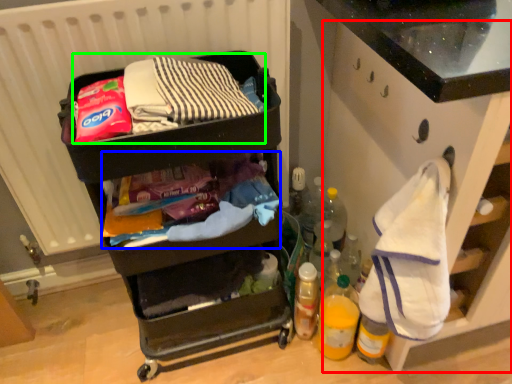
Question: Which object is positioned closest to cabinetry (highlighted by a red box)? Select from waste (highlighted by a blue box) and waste (highlighted by a green box).

Choices:
 (A) waste
 (B) waste

Answer: (A)